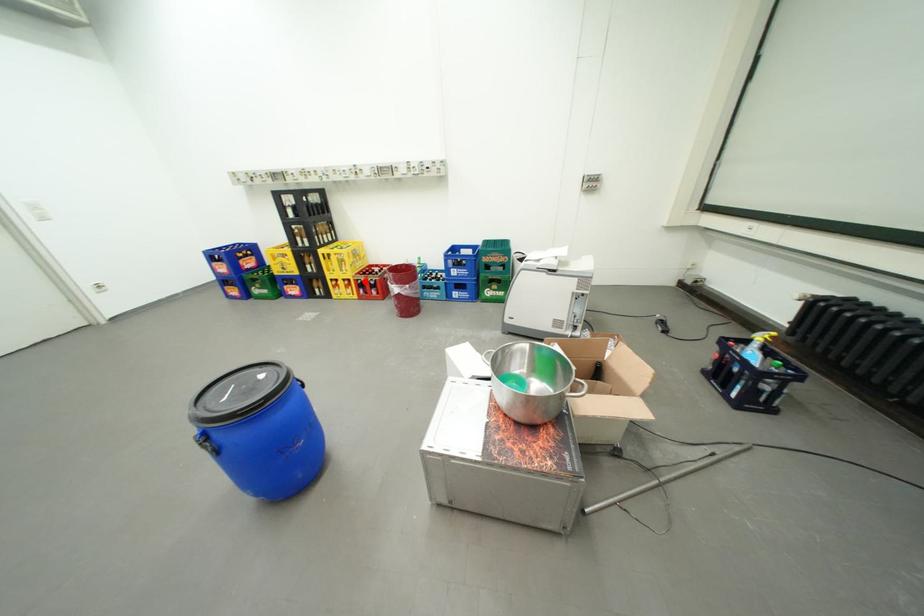
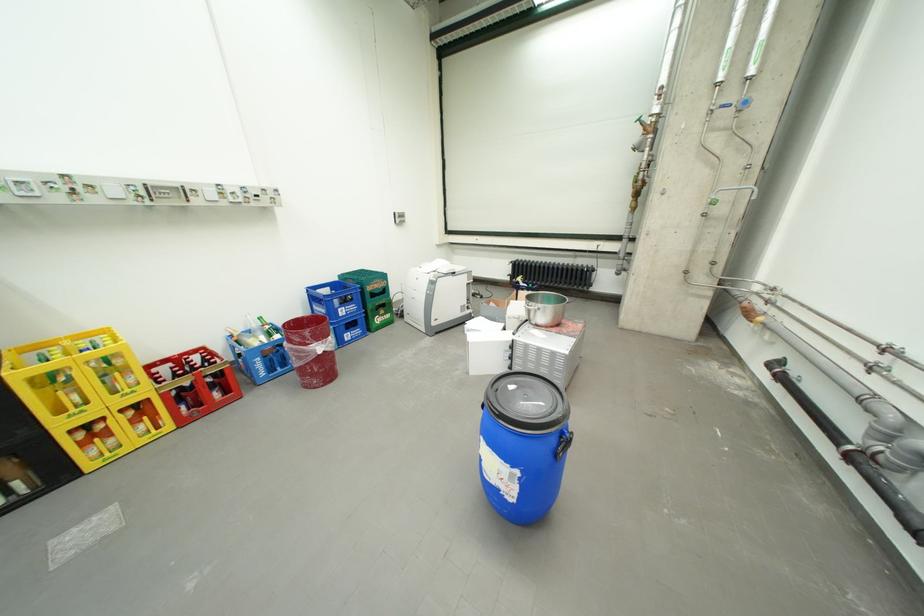
Question: I am providing you with two images of the same scene from different viewpoints. A red point is shown in image1. For the corresponding object point in image2, is it positioned nearer or farther from the camera?

Choices:
 (A) Nearer
 (B) Farther

Answer: (A)